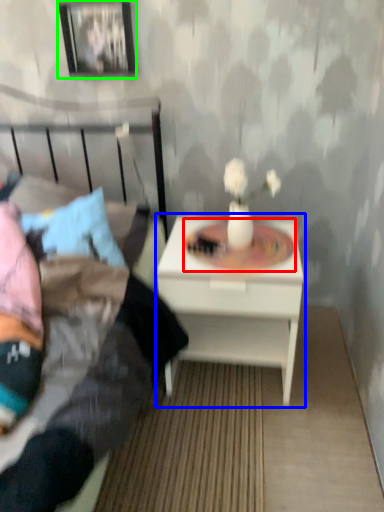
Question: Which object is positioned farthest from round table (highlighted by a red box)? Select from nightstand (highlighted by a blue box) and picture frame (highlighted by a green box).

Choices:
 (A) nightstand
 (B) picture frame

Answer: (B)